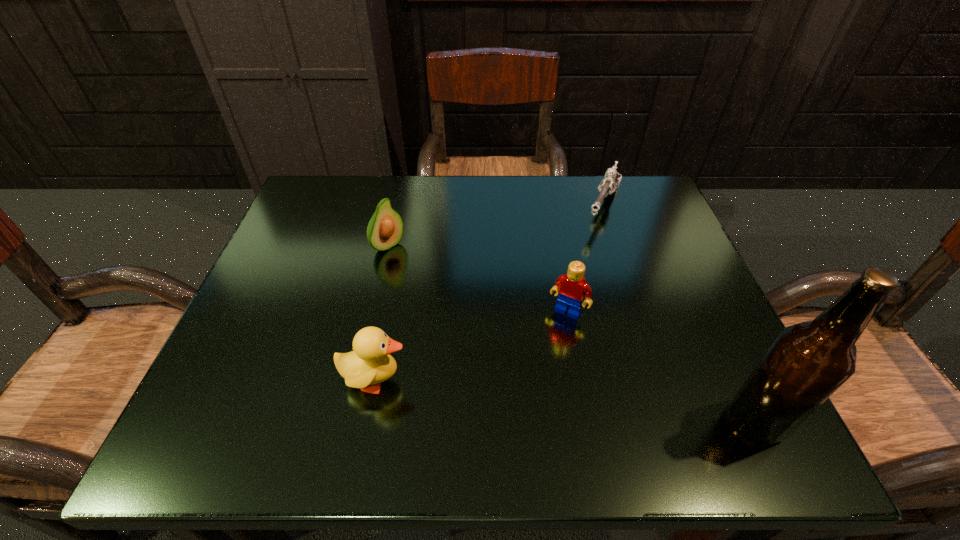
Identify the location of blank region between the duckling and the rightmost object. (565, 400).

Where is `object that stands as the third closest to the tallest object`? object that stands as the third closest to the tallest object is located at coordinates (370, 363).

Identify the location of the fourth closest object to the Lego. Image resolution: width=960 pixels, height=540 pixels. (385, 229).

Identify the location of vacant space that satisfies the following two spatial constraints: 1. on the back side of the shortest object; 2. on the left side of the avocado. The width and height of the screenshot is (960, 540). (397, 205).

Locate an element on the screen. Image resolution: width=960 pixels, height=540 pixels. free space in the image that satisfies the following two spatial constraints: 1. on the front side of the duckling; 2. on the front-facing side of the fourth nearest object is located at coordinates (358, 380).